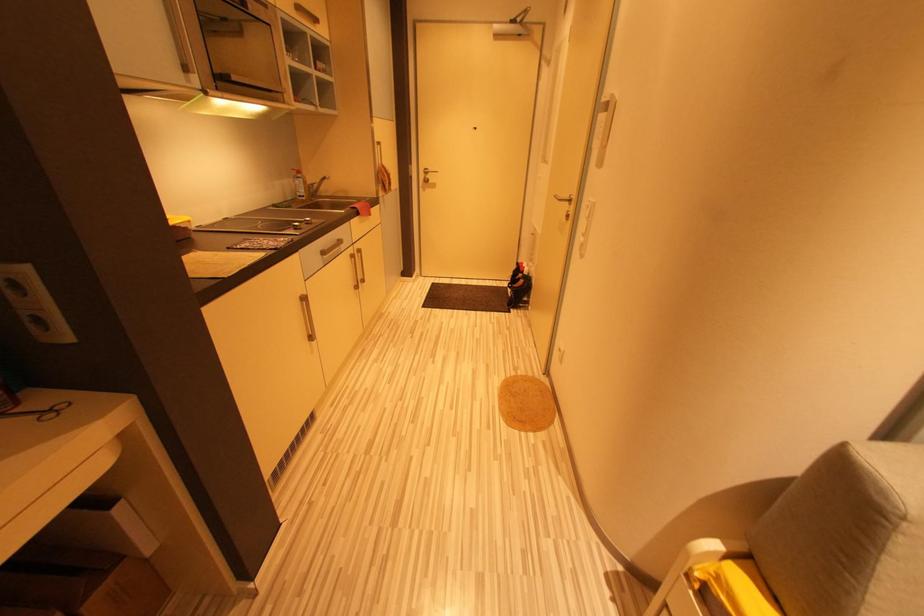
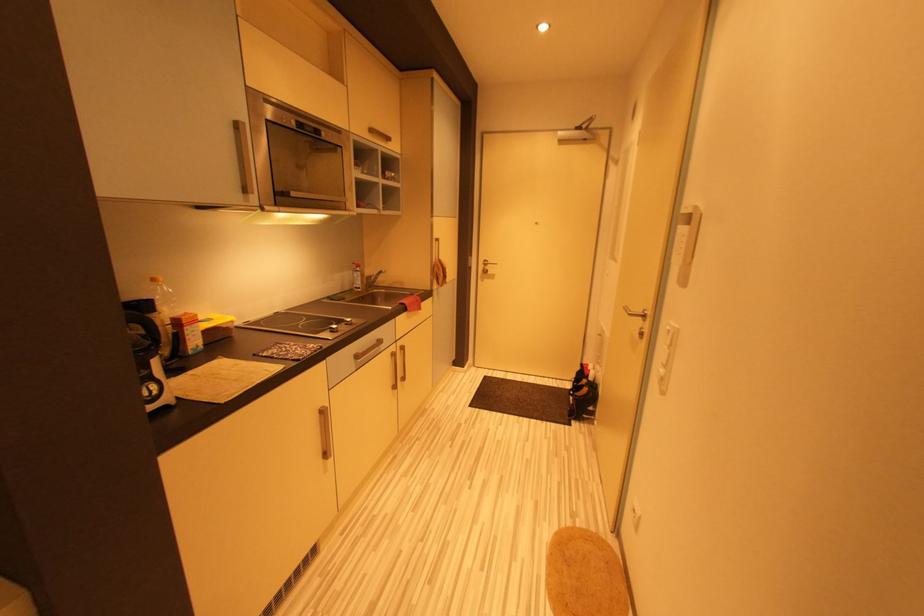
Question: The first image is from the beginning of the video and the second image is from the end. How did the camera likely rotate when shooting the video?

Choices:
 (A) Left
 (B) Right
 (C) Up
 (D) Down

Answer: (A)